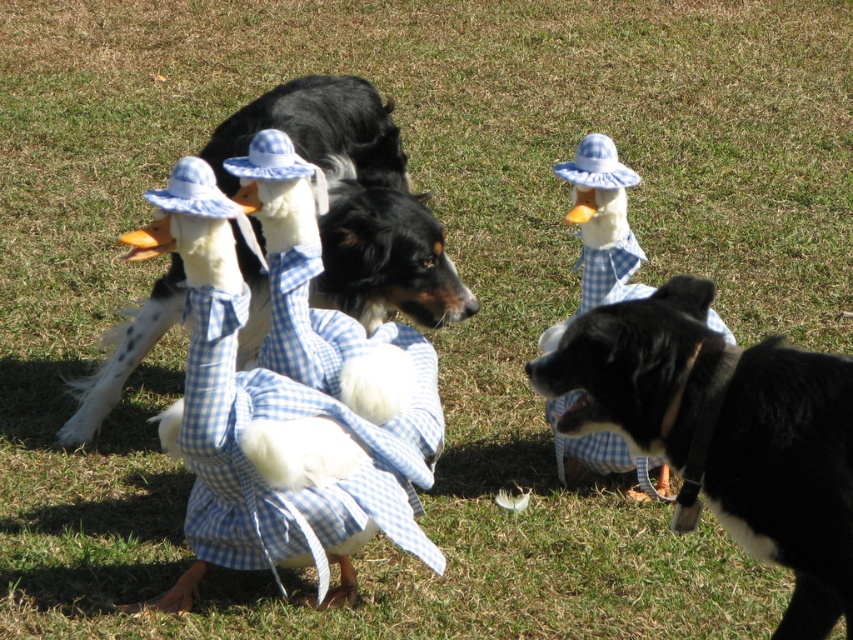
Does black fur dog at center appear over blue gingham duck at center?

Actually, black fur dog at center is below blue gingham duck at center.

Measure the distance between black fur dog at center and camera.

black fur dog at center is 2.86 meters away from camera.

At what (x,y) coordinates should I click in order to perform the action: click on black fur dog at center. Please return your answer as a coordinate pair (x, y). Looking at the image, I should click on [788, 476].

Between blue checkered dress at center and blue gingham duck at center, which one appears on the left side from the viewer's perspective?

Positioned to the left is blue checkered dress at center.

Does point (204, 256) lie behind point (590, 449)?

No.

The width and height of the screenshot is (853, 640). Find the location of `blue checkered dress at center`. blue checkered dress at center is located at coordinates (288, 390).

Based on the photo, is black fur dog at center shorter than black glossy dog at center?

Yes.

This screenshot has height=640, width=853. What do you see at coordinates (788, 476) in the screenshot? I see `black fur dog at center` at bounding box center [788, 476].

The height and width of the screenshot is (640, 853). I want to click on black fur dog at center, so click(x=788, y=476).